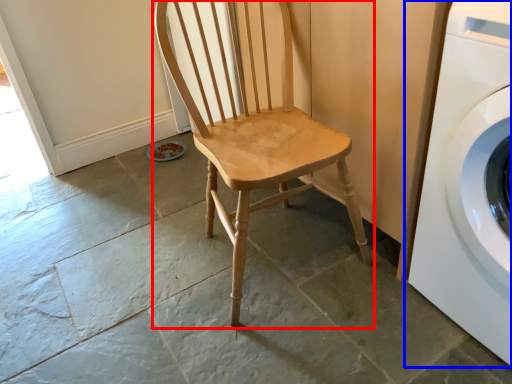
Question: Among these objects, which one is farthest to the camera, chair (highlighted by a red box) or washing machine (highlighted by a blue box)?

Choices:
 (A) chair
 (B) washing machine

Answer: (A)